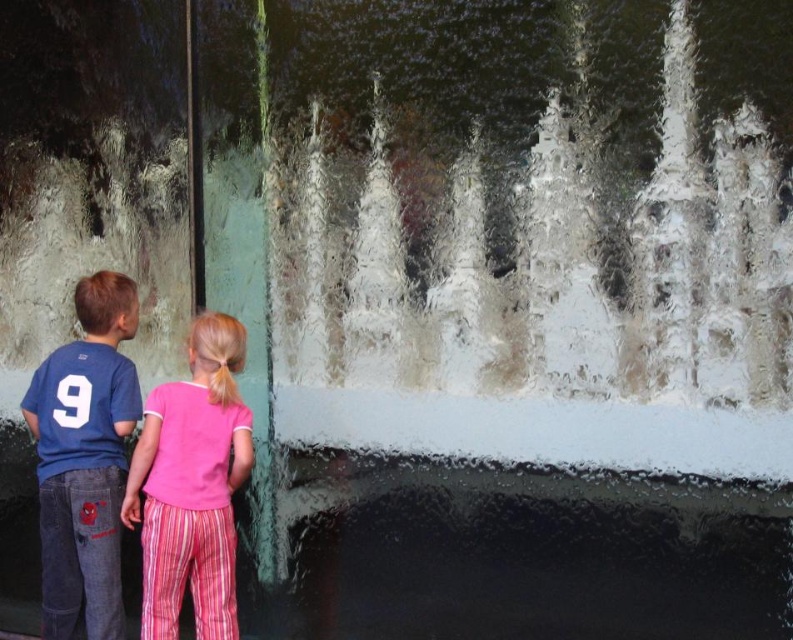
You are a photographer trying to capture the children through the condensation on the window. The blue jersey at center is represented by point [83,460]. Where should you focus your camera to ensure the blue jersey at center is in sharp focus?

You should focus your camera at point [83,460] where the blue jersey at center is located to ensure it is in sharp focus.

You are a photographer trying to capture a candid shot of the two children in the scene. You want to ensure that the blue jersey at center and the pink cotton shirt at center are both visible in the frame. Based on their positions, which child should you position closer to the left side of the photo to maintain their natural arrangement?

The blue jersey at center is to the left of the pink cotton shirt at center, so you should position the child wearing the blue jersey at center closer to the left side of the photo to maintain their natural arrangement.